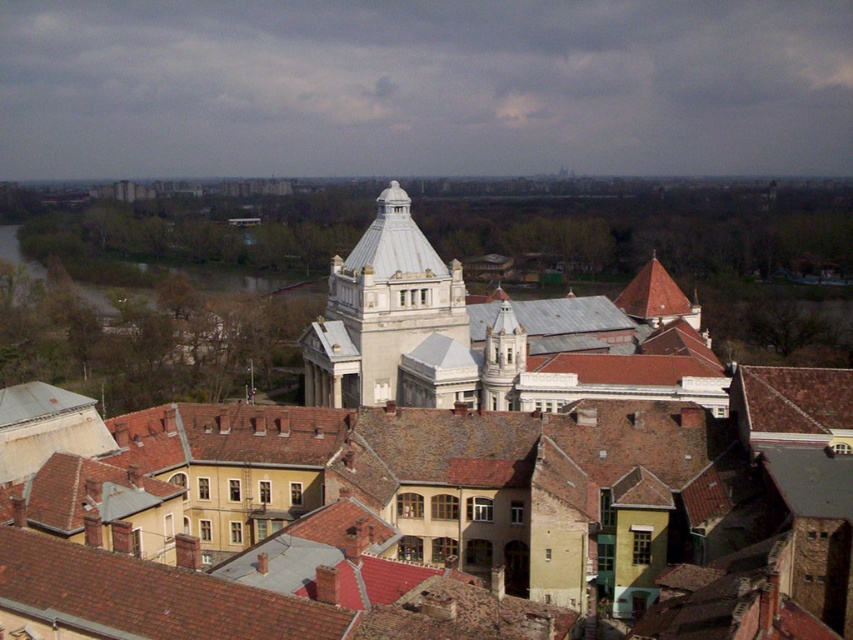
Question: Which point is farther to the camera?

Choices:
 (A) white marble tower at center
 (B) brown muddy water at left
 (C) white stone building at center

Answer: (B)

Question: Can you confirm if white stone building at center is thinner than brown muddy water at left?

Choices:
 (A) yes
 (B) no

Answer: (A)

Question: Can you confirm if white stone building at center is positioned below brown muddy water at left?

Choices:
 (A) no
 (B) yes

Answer: (B)

Question: Which object is positioned farthest from the brown muddy water at left?

Choices:
 (A) white stone building at center
 (B) white marble tower at center

Answer: (A)

Question: Which of the following is the farthest from the observer?

Choices:
 (A) brown muddy water at left
 (B) white marble tower at center
 (C) white stone building at center

Answer: (A)

Question: Is white marble tower at center bigger than brown muddy water at left?

Choices:
 (A) yes
 (B) no

Answer: (B)